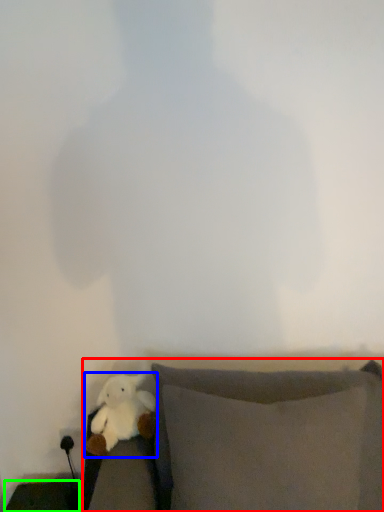
Question: Which is farther away from furniture (highlighted by a red box)? toy (highlighted by a blue box) or furniture (highlighted by a green box)?

Choices:
 (A) toy
 (B) furniture

Answer: (B)